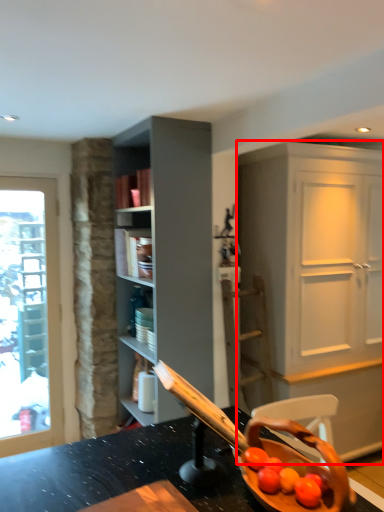
Question: From the image's perspective, considering the relative positions of cabinetry (annotated by the red box) and shelf in the image provided, where is cabinetry (annotated by the red box) located with respect to the staircase?

Choices:
 (A) above
 (B) below

Answer: (B)